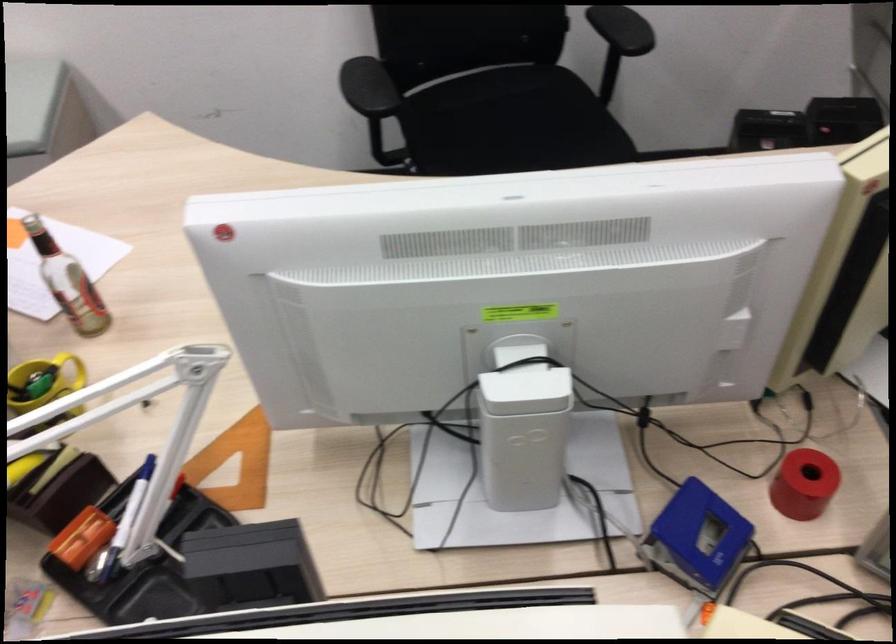
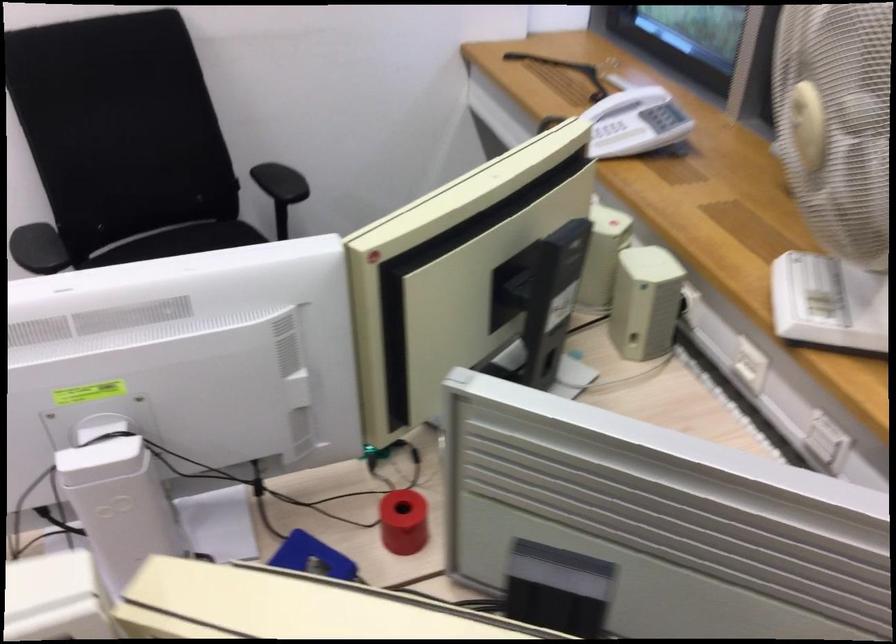
The point at (487,80) is marked in the first image. Where is the corresponding point in the second image?

(179, 240)